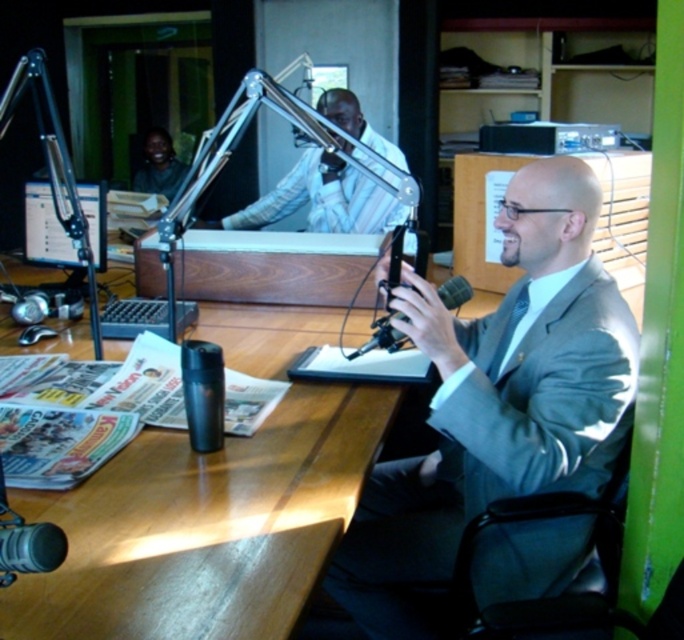
You are a technician in the studio and need to adjust two points on the control panel. The points are located at coordinates point [107,536] and point [36,196]. Which point is closer to you?

Point [107,536] is closer to the viewer than point [36,196].

You are a technician in the radio studio. You need to adjust the microphone stand for the man seated at the wooden desk. The stand is currently at point (514, 346). If the recommended distance between the microphone and the speaker is 1.5 meters, can the technician move the stand closer to the man?

The distance between them is 1.43 meters, which is less than the recommended 1.5 meters. Therefore, the technician does not need to move the stand closer. It is already within the recommended distance range.